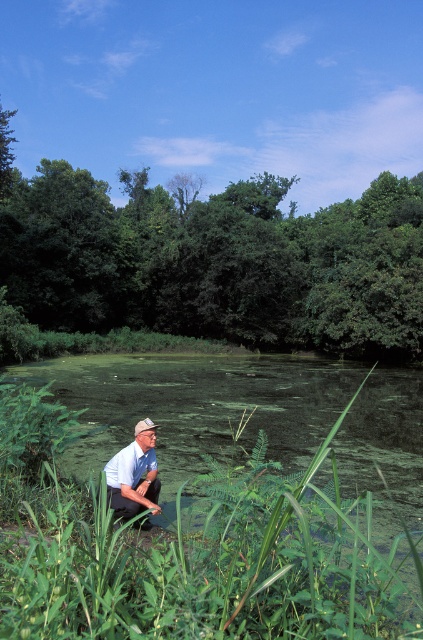
Does point (340, 225) come closer to viewer compared to point (123, 458)?

No, it is not.

Measure the distance between point (406,204) and camera.

Point (406,204) and camera are 56.85 meters apart from each other.

Image resolution: width=423 pixels, height=640 pixels. I want to click on green leafy tree at center, so click(x=214, y=259).